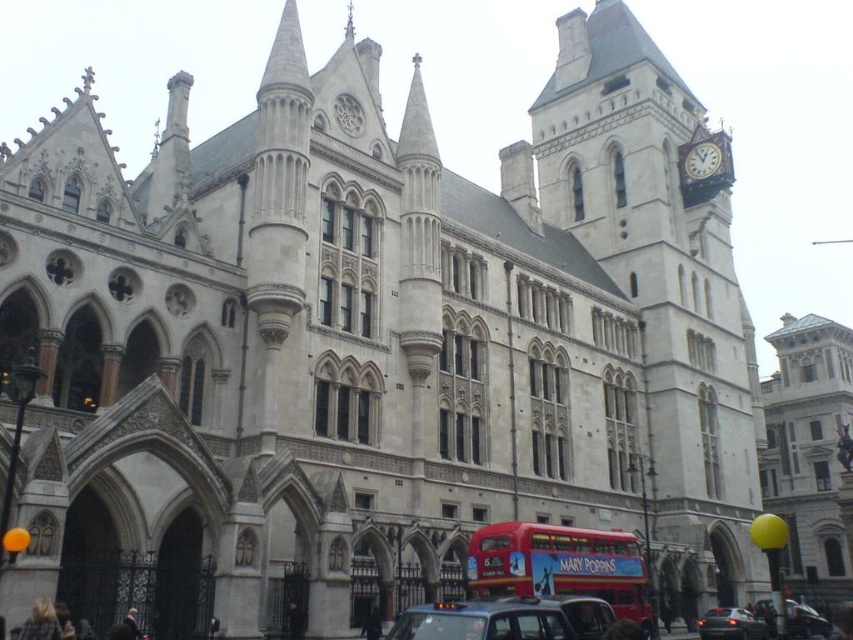
Does red matte double-decker bus at center have a lesser width compared to white wooden clock at upper right?

No.

Between point (519, 552) and point (704, 173), which one is positioned behind?

Positioned behind is point (704, 173).

The width and height of the screenshot is (853, 640). Find the location of `red matte double-decker bus at center`. red matte double-decker bus at center is located at coordinates (561, 566).

Who is positioned more to the right, red matte double-decker bus at center or shiny black sedan at lower right?

From the viewer's perspective, shiny black sedan at lower right appears more on the right side.

From the picture: Is red matte double-decker bus at center wider than shiny black sedan at lower right?

Indeed, red matte double-decker bus at center has a greater width compared to shiny black sedan at lower right.

Between point (489, 589) and point (755, 618), which one is positioned in front?

Point (489, 589) is in front.

Where is `red matte double-decker bus at center`? The width and height of the screenshot is (853, 640). red matte double-decker bus at center is located at coordinates (561, 566).

Can you confirm if metallic silver car at lower right is positioned below shiny black sedan at lower right?

Yes, metallic silver car at lower right is below shiny black sedan at lower right.

From the picture: Who is positioned more to the right, metallic silver car at lower right or shiny black sedan at lower right?

From the viewer's perspective, metallic silver car at lower right appears more on the right side.

Which is behind, point (787, 609) or point (721, 628)?

Point (787, 609)

Locate an element on the screen. The image size is (853, 640). metallic silver car at lower right is located at coordinates (804, 621).